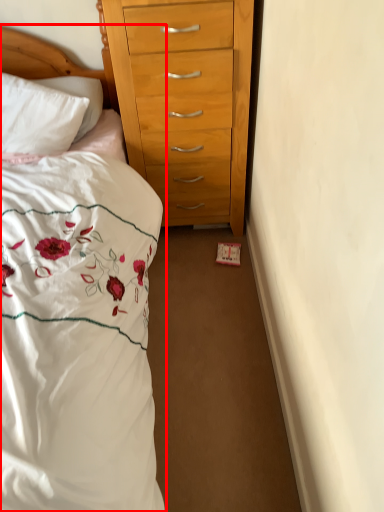
Question: Observing the image, what is the correct spatial positioning of bed (annotated by the red box) in reference to headboard?

Choices:
 (A) left
 (B) right

Answer: (B)